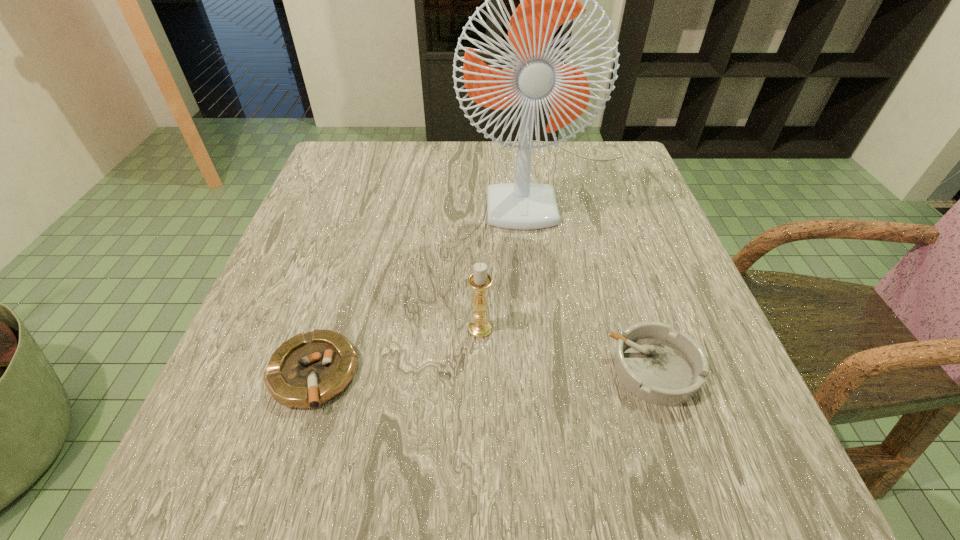
This screenshot has width=960, height=540. What are the coordinates of `unoccupied area between the third shortest object and the leftmost object` in the screenshot? It's located at (396, 351).

Where is `the third closest object relative to the fan`? The width and height of the screenshot is (960, 540). the third closest object relative to the fan is located at coordinates (310, 369).

Identify the location of object that ranks as the second closest to the shortest object. 547,0.

You are a GUI agent. You are given a task and a screenshot of the screen. Output one action in this format:
    pyautogui.click(x=<x>, y=<y>)
    Task: Click on the free space that satisfies the following two spatial constraints: 1. on the front-facing side of the tallest object; 2. on the right side of the right ashtray
    
    Given the screenshot: What is the action you would take?
    pyautogui.click(x=585, y=369)